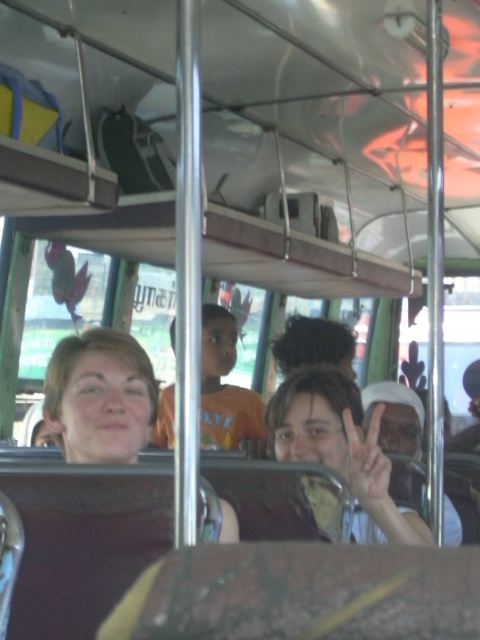
You are standing at the back of the bus and want to reach the front. There is a point marked at coordinates (225,387). What object is this point located on?

The point at (225,387) is located on the orange t shirt at center.